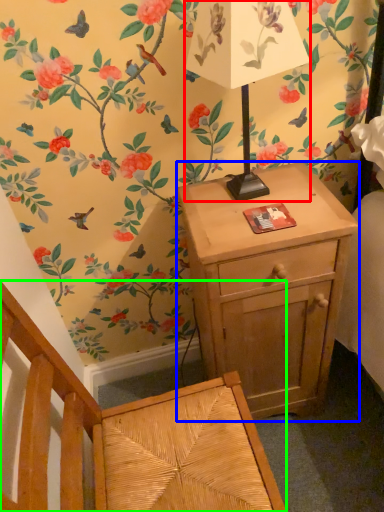
Question: Which object is positioned farthest from table lamp (highlighted by a red box)? Select from nightstand (highlighted by a blue box) and armchair (highlighted by a green box).

Choices:
 (A) nightstand
 (B) armchair

Answer: (B)